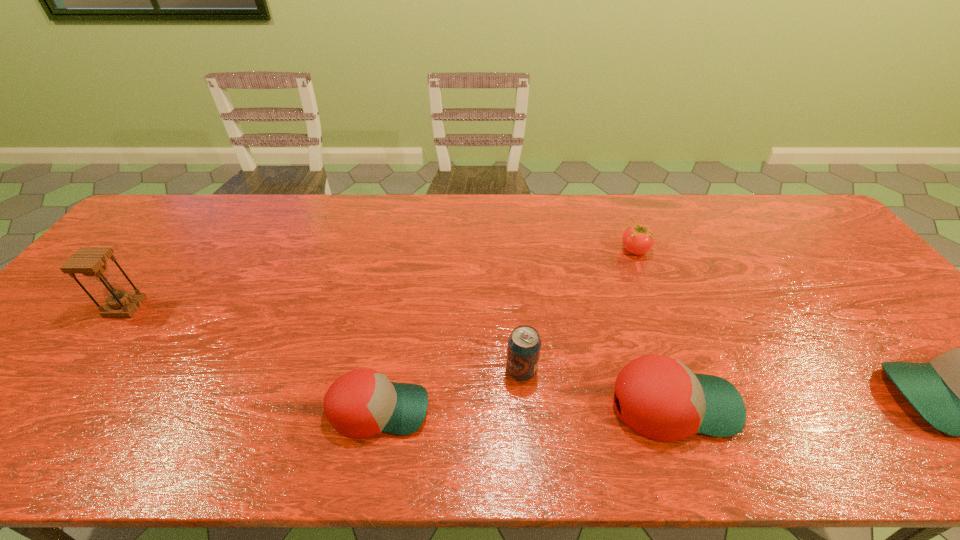
The image size is (960, 540). I want to click on free space located 0.060m on the front of the tomato, so click(644, 274).

At what (x,y) coordinates should I click in order to perform the action: click on vacant space located 0.390m on the right of the tallest object. Please return your answer as a coordinate pair (x, y). Looking at the image, I should click on tap(285, 307).

Locate an element on the screen. The image size is (960, 540). free region located 0.330m on the right of the pop soda is located at coordinates (678, 370).

This screenshot has height=540, width=960. I want to click on pop soda positioned at the near edge, so (524, 343).

You are a GUI agent. You are given a task and a screenshot of the screen. Output one action in this format:
    pyautogui.click(x=<x>, y=<y>)
    Task: Click on the object positioned at the left edge
    The image size is (960, 540).
    Given the screenshot: What is the action you would take?
    pyautogui.click(x=90, y=261)

Where is `free region at the far edge of the desktop`? This screenshot has height=540, width=960. free region at the far edge of the desktop is located at coordinates 275,219.

Image resolution: width=960 pixels, height=540 pixels. Identify the location of vacant region at the near edge of the desktop. (531, 384).

Locate an element on the screen. The height and width of the screenshot is (540, 960). vacant space at the far left corner is located at coordinates (166, 228).

In order to click on vacant space that's between the farthest object and the third object from left to right in this screenshot , I will do `click(578, 310)`.

Where is `free space between the hourglass and the tomato`? The height and width of the screenshot is (540, 960). free space between the hourglass and the tomato is located at coordinates (380, 279).